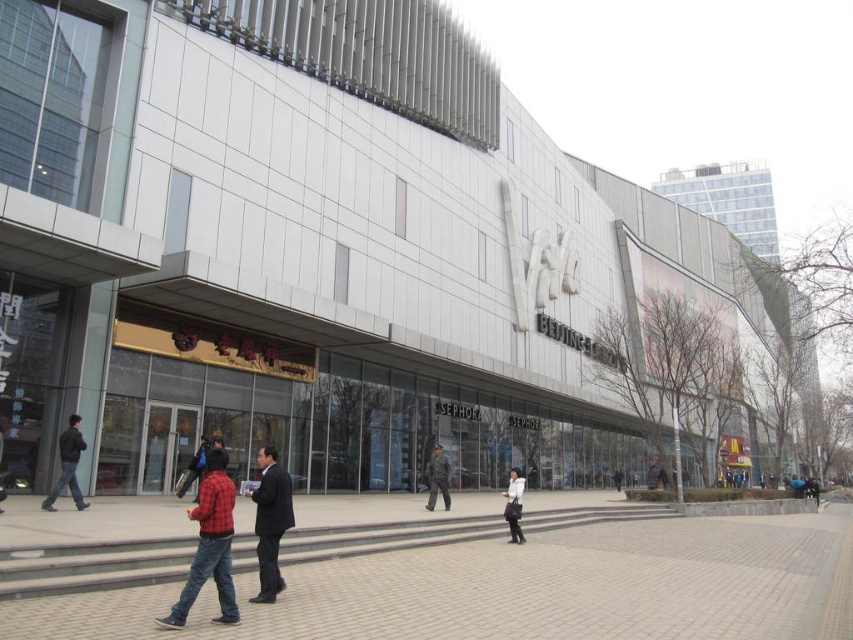
You are standing at point A located at point (314, 596). You want to walk to point B which is 39.75 feet away from you. Is there a clear path between you and point B?

Yes, there is a clear path between point A located at point (314, 596) and point B since the distance is 39.75 feet and there are no obstructions mentioned in the scene description.

You are a delivery person standing on the gray concrete pavement at lower left and need to deliver a package to the white matte jacket at center. What is the shortest path you can take to reach the jacket without crossing any obstacles?

The shortest path would be to move directly towards the white matte jacket at center from the gray concrete pavement at lower left, as there are no obstacles mentioned in the scene description between these two points. However, since the gray concrete pavement at lower left might be wider than the white matte jacket at center, you should stay within the pavement area to ensure a clear path.

You are a delivery person standing on the gray concrete pavement at lower left and you need to deliver a package to the white matte jacket at center. Can you walk directly to the jacket without crossing any obstacles?

The gray concrete pavement at lower left is bigger than white matte jacket at center, so yes, you can walk directly to the white matte jacket at center without crossing any obstacles since the pavement provides enough space.